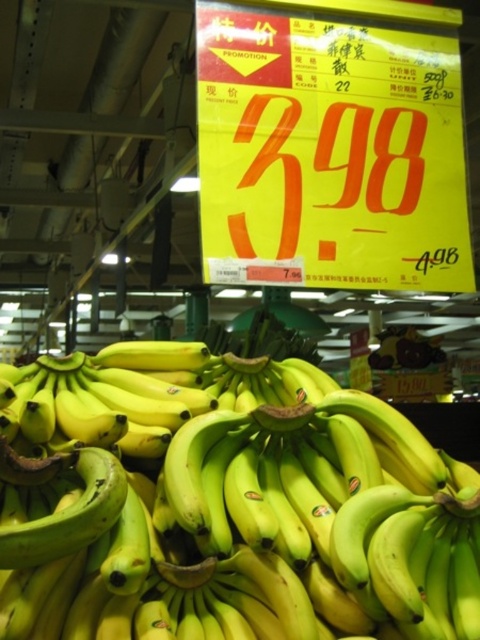
Question: Which of the following is the farthest from the observer?

Choices:
 (A) (332, 429)
 (B) (301, 77)

Answer: (B)

Question: Can you confirm if yellow matte bananas at center is positioned to the left of yellow paper sign at center?

Choices:
 (A) yes
 (B) no

Answer: (A)

Question: Which object is closer to the camera taking this photo?

Choices:
 (A) yellow paper sign at center
 (B) yellow matte bananas at center

Answer: (B)

Question: Can you confirm if yellow matte bananas at center is thinner than yellow paper sign at center?

Choices:
 (A) no
 (B) yes

Answer: (A)

Question: Observing the image, what is the correct spatial positioning of yellow matte bananas at center in reference to yellow paper sign at center?

Choices:
 (A) right
 (B) left

Answer: (B)